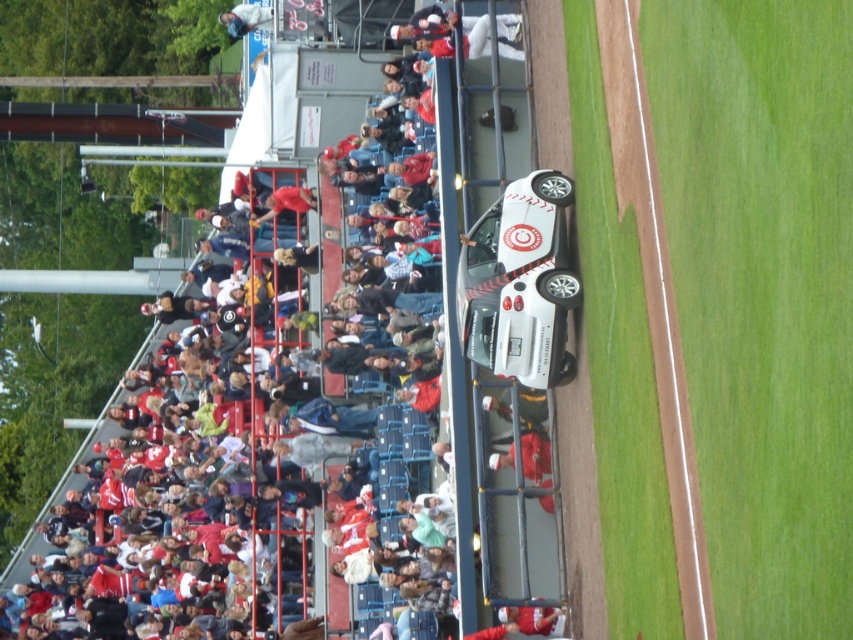
Between brown dirt track at center and white matte race car at upper center, which one is positioned higher?

brown dirt track at center is higher up.

Does brown dirt track at center have a greater width compared to white matte race car at upper center?

Incorrect, brown dirt track at center's width does not surpass white matte race car at upper center's.

Where is `brown dirt track at center`? The image size is (853, 640). brown dirt track at center is located at coordinates (654, 298).

Image resolution: width=853 pixels, height=640 pixels. In order to click on brown dirt track at center in this screenshot , I will do `click(654, 298)`.

Identify the location of brown dirt track at center. This screenshot has height=640, width=853. (654, 298).

Between brown dirt track at center and white plastic cup at upper center, which one has more height?

brown dirt track at center

Is point (689, 417) behind point (241, 8)?

No, it is not.

Find the location of a particular element. brown dirt track at center is located at coordinates (654, 298).

Who is lower down, white matte race car at upper center or white plastic cup at upper center?

white matte race car at upper center

Can you confirm if white matte race car at upper center is shorter than white plastic cup at upper center?

Incorrect, white matte race car at upper center's height does not fall short of white plastic cup at upper center's.

Between point (485, 324) and point (257, 8), which one is positioned behind?

The point (257, 8) is behind.

The image size is (853, 640). In order to click on white matte race car at upper center in this screenshot , I will do `click(519, 284)`.